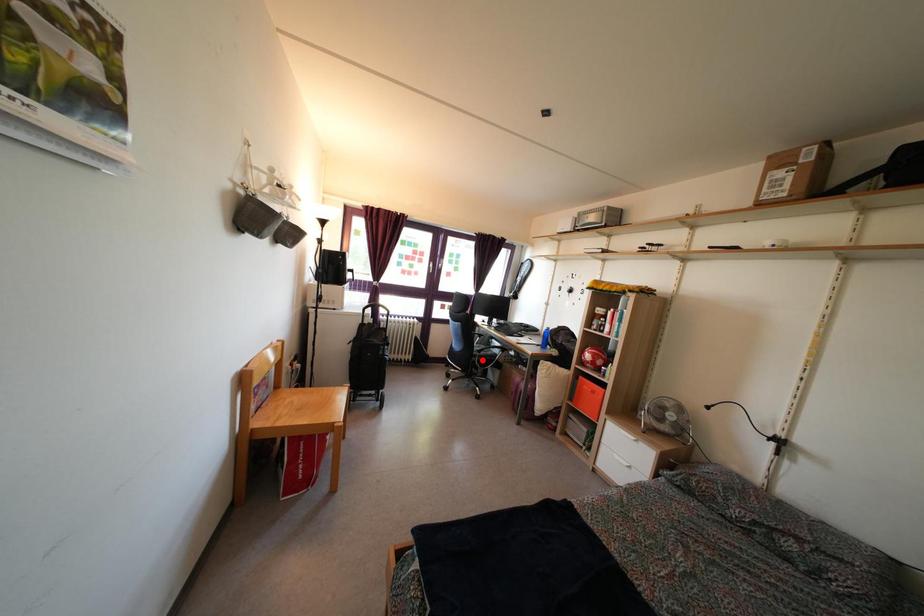
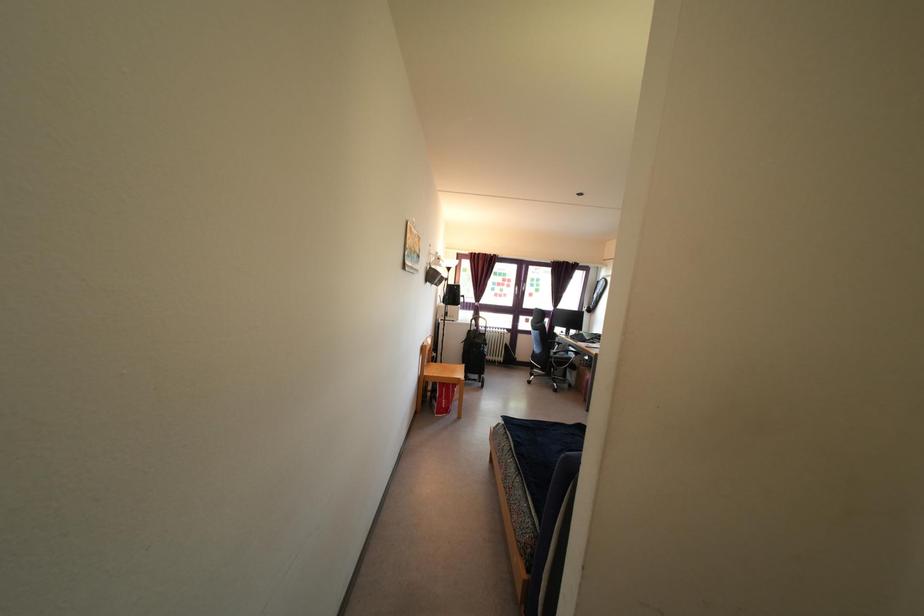
Question: A red point is marked in image1. In image2, is the corresponding 3D point closer to the camera or farther? Reply with the corresponding letter.

Choices:
 (A) The corresponding 3D point is closer.
 (B) The corresponding 3D point is farther.

Answer: (A)